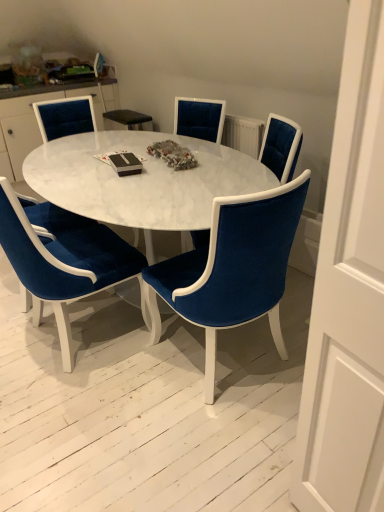
Locate an element on the screen. vacant space in between velvet blue chair at center, which is the fourth chair in left-to-right order, and velvet blue chair at center, the fourth chair when ordered from right to left is located at coordinates (125, 373).